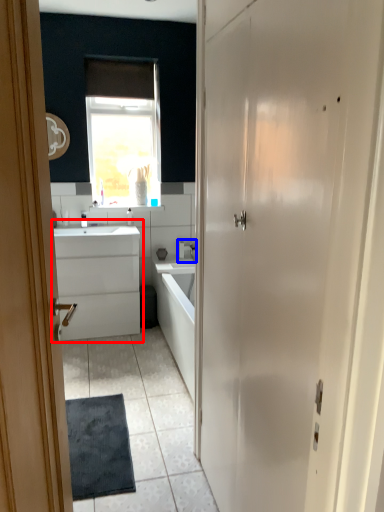
Question: Which object appears closest to the camera in this image, bathroom cabinet (highlighted by a red box) or tap (highlighted by a blue box)?

Choices:
 (A) bathroom cabinet
 (B) tap

Answer: (A)